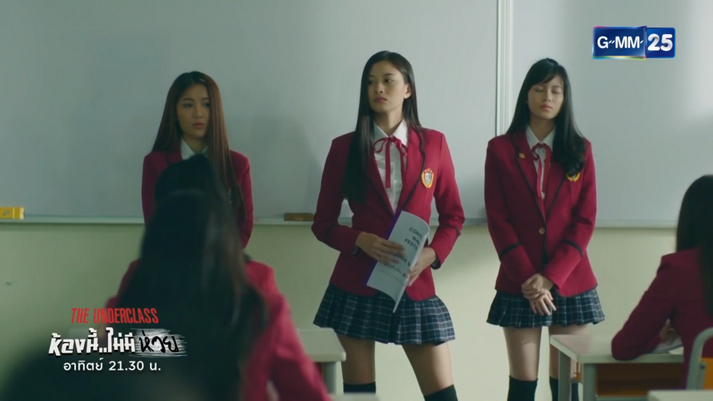
Where is `whiteboard`? whiteboard is located at coordinates (264, 92).